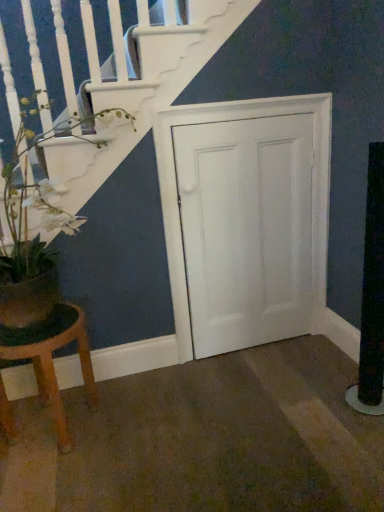
Question: Does white wood door at center appear on the right side of green matte plant at left?

Choices:
 (A) yes
 (B) no

Answer: (A)

Question: Considering the relative sizes of white wood door at center and green matte plant at left in the image provided, is white wood door at center thinner than green matte plant at left?

Choices:
 (A) no
 (B) yes

Answer: (B)

Question: From a real-world perspective, is white wood door at center beneath green matte plant at left?

Choices:
 (A) yes
 (B) no

Answer: (A)

Question: Does white wood door at center have a greater width compared to green matte plant at left?

Choices:
 (A) yes
 (B) no

Answer: (B)

Question: Does white wood door at center have a greater height compared to green matte plant at left?

Choices:
 (A) yes
 (B) no

Answer: (A)

Question: Considering the positions of white wood door at center and wooden stool at lower left in the image, is white wood door at center wider or thinner than wooden stool at lower left?

Choices:
 (A) wide
 (B) thin

Answer: (B)

Question: Is point (215, 352) closer or farther from the camera than point (51, 335)?

Choices:
 (A) farther
 (B) closer

Answer: (A)

Question: Is white wood door at center in front of or behind wooden stool at lower left in the image?

Choices:
 (A) behind
 (B) front

Answer: (A)

Question: Is white wood door at center to the left or to the right of wooden stool at lower left in the image?

Choices:
 (A) right
 (B) left

Answer: (A)

Question: From a real-world perspective, is wooden stool at lower left positioned above or below green matte plant at left?

Choices:
 (A) below
 (B) above

Answer: (A)

Question: Which is correct: wooden stool at lower left is inside green matte plant at left, or outside of it?

Choices:
 (A) outside
 (B) inside

Answer: (A)

Question: From the image's perspective, relative to green matte plant at left, is wooden stool at lower left above or below?

Choices:
 (A) above
 (B) below

Answer: (B)

Question: Relative to green matte plant at left, is wooden stool at lower left in front or behind?

Choices:
 (A) behind
 (B) front

Answer: (A)

Question: From a real-world perspective, is wooden stool at lower left above or below white wood door at center?

Choices:
 (A) below
 (B) above

Answer: (A)

Question: Considering the positions of wooden stool at lower left and white wood door at center in the image, is wooden stool at lower left wider or thinner than white wood door at center?

Choices:
 (A) wide
 (B) thin

Answer: (A)